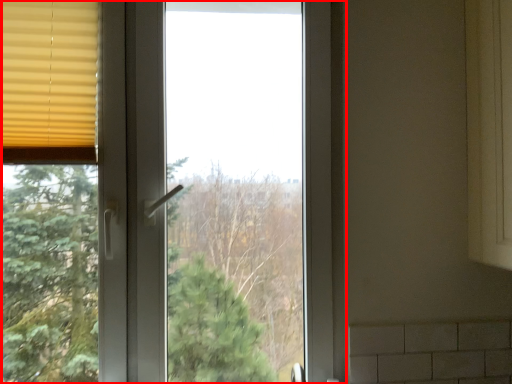
Question: From the image, what is the correct spatial relationship of window (annotated by the red box) in relation to window blind?

Choices:
 (A) left
 (B) right

Answer: (B)